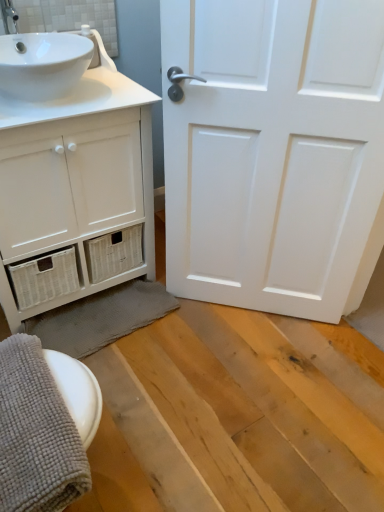
Where is `vacant region above white glossy sink at upper left (from a real-world perspective)`? vacant region above white glossy sink at upper left (from a real-world perspective) is located at coordinates (46, 42).